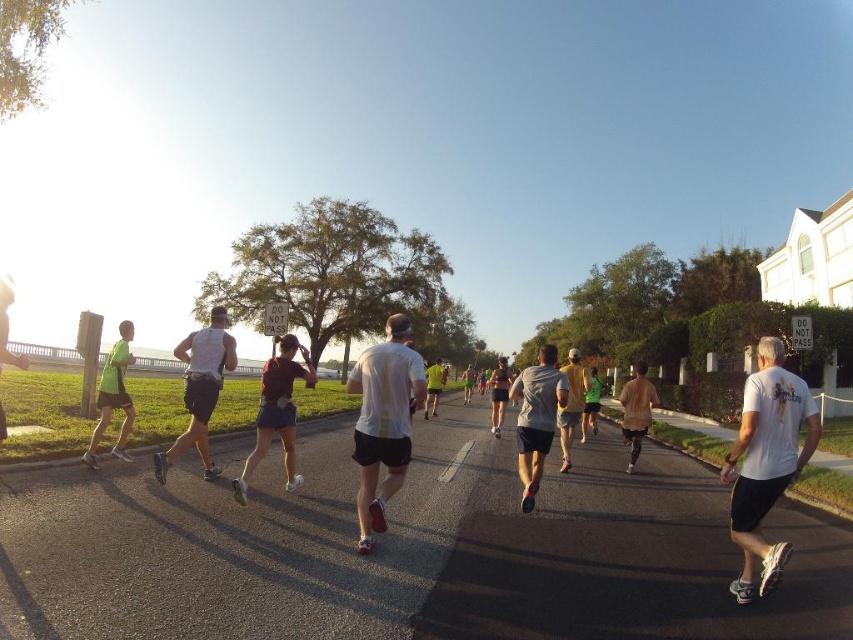
Does white matte t-shirt at right appear on the right side of yellow fabric shirt at center?

Yes, white matte t-shirt at right is to the right of yellow fabric shirt at center.

Can you confirm if white matte t-shirt at right is positioned below yellow fabric shirt at center?

No, white matte t-shirt at right is not below yellow fabric shirt at center.

Does point (793, 451) come behind point (587, 381)?

No, (793, 451) is closer to viewer.

At what (x,y) coordinates should I click in order to perform the action: click on white matte t-shirt at right. Please return your answer as a coordinate pair (x, y). Image resolution: width=853 pixels, height=640 pixels. Looking at the image, I should click on (766, 461).

Between white matte shirt at center and yellow fabric shirt at center, which one appears on the left side from the viewer's perspective?

Positioned to the left is white matte shirt at center.

Between white matte shirt at center and yellow fabric shirt at center, which one appears on the right side from the viewer's perspective?

yellow fabric shirt at center is more to the right.

Which is behind, point (387, 422) or point (572, 392)?

The point (572, 392) is behind.

Locate an element on the screen. white matte shirt at center is located at coordinates [x=383, y=420].

Can you confirm if white matte shirt at center is bigger than matte pink shorts at center?

No, white matte shirt at center is not bigger than matte pink shorts at center.

Between point (376, 492) and point (258, 445), which one is positioned in front?

Point (376, 492) is more forward.

Where is `white matte shirt at center`? This screenshot has width=853, height=640. white matte shirt at center is located at coordinates (383, 420).